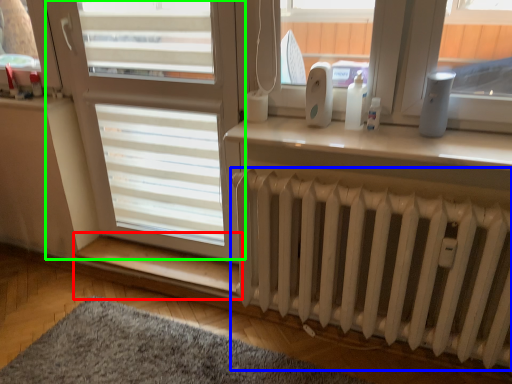
Question: Considering the real-world distances, which object is closest to window sill (highlighted by a red box)? radiator (highlighted by a blue box) or screen door (highlighted by a green box).

Choices:
 (A) radiator
 (B) screen door

Answer: (B)